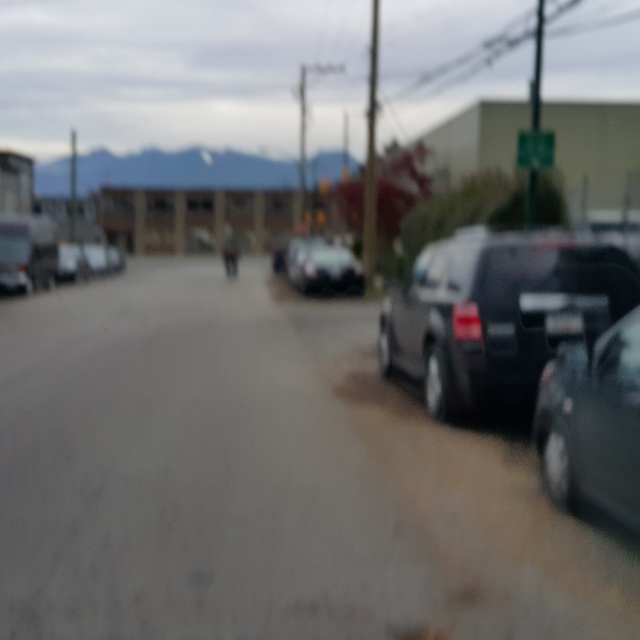
You are driving a car that is 15 feet long and want to park it in the space where the matte black van at right is currently parked. If the parking space is only 16 feet long, will your car fit comfortably?

The parking space where the matte black van at right is parked is 31.95 feet away from the camera. However, the question is about the length of the parking space itself, not the distance from the camera. Since the parking space is 16 feet long and your car is 15 feet long, your car will fit, but there will be very little room to spare. It might be tight but possible.

You are a pedestrian standing on the sidewalk and want to cross the street. You see the matte black van at right and the satin black car at center. Which vehicle is closer to the road surface?

The matte black van at right is located below the satin black car at center, so it is closer to the road surface.

In the scene shown: You are a delivery driver who needs to park your vehicle between two satin black cars. The first is the satin black car at right and the second is the satin black car at center. Given that your delivery van is 6 meters long, is there enough space between them to park your van?

The distance between the satin black car at right and the satin black car at center is 29.36 meters. Since your van is only 6 meters long, there is sufficient space between them to park your van.